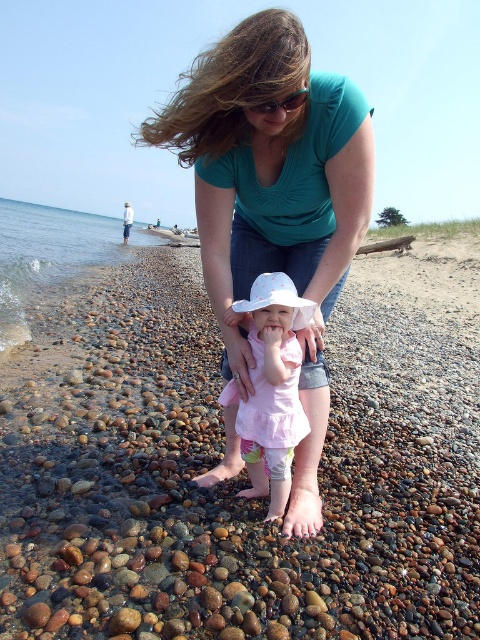
Who is higher up, pink fabric dress at center or clear water at lower left?

Positioned higher is clear water at lower left.

Is the position of pink fabric dress at center less distant than that of clear water at lower left?

That is True.

You are a GUI agent. You are given a task and a screenshot of the screen. Output one action in this format:
    pyautogui.click(x=<x>, y=<y>)
    Task: Click on the pink fabric dress at center
    Image resolution: width=480 pixels, height=640 pixels.
    Given the screenshot: What is the action you would take?
    pyautogui.click(x=272, y=388)

The width and height of the screenshot is (480, 640). In order to click on pink fabric dress at center in this screenshot , I will do `click(272, 388)`.

Does matte teal shirt at center appear on the right side of pink fabric dress at center?

No, matte teal shirt at center is not to the right of pink fabric dress at center.

Identify the location of matte teal shirt at center. The image size is (480, 640). tap(274, 196).

Can you confirm if matte teal shirt at center is wider than clear water at lower left?

Incorrect, matte teal shirt at center's width does not surpass clear water at lower left's.

Which is below, matte teal shirt at center or clear water at lower left?

matte teal shirt at center is lower down.

The height and width of the screenshot is (640, 480). I want to click on matte teal shirt at center, so click(274, 196).

At what (x,y) coordinates should I click in order to perform the action: click on matte teal shirt at center. Please return your answer as a coordinate pair (x, y). Looking at the image, I should click on (274, 196).